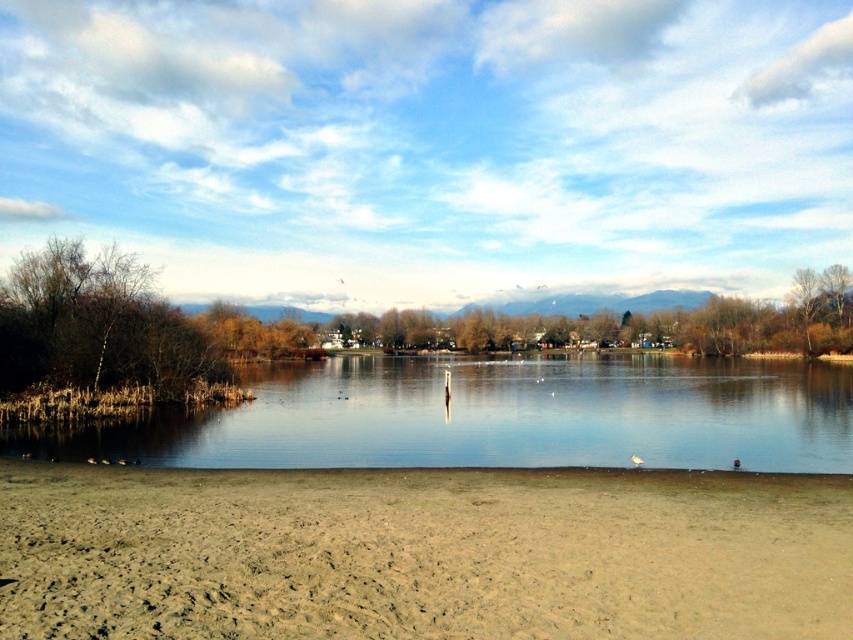
This screenshot has width=853, height=640. Describe the element at coordinates (421, 554) in the screenshot. I see `brown sandy beach at lower center` at that location.

Locate an element on the screen. brown sandy beach at lower center is located at coordinates (421, 554).

Where is `brown sandy beach at lower center`? brown sandy beach at lower center is located at coordinates (421, 554).

Locate an element on the screen. brown sandy beach at lower center is located at coordinates (421, 554).